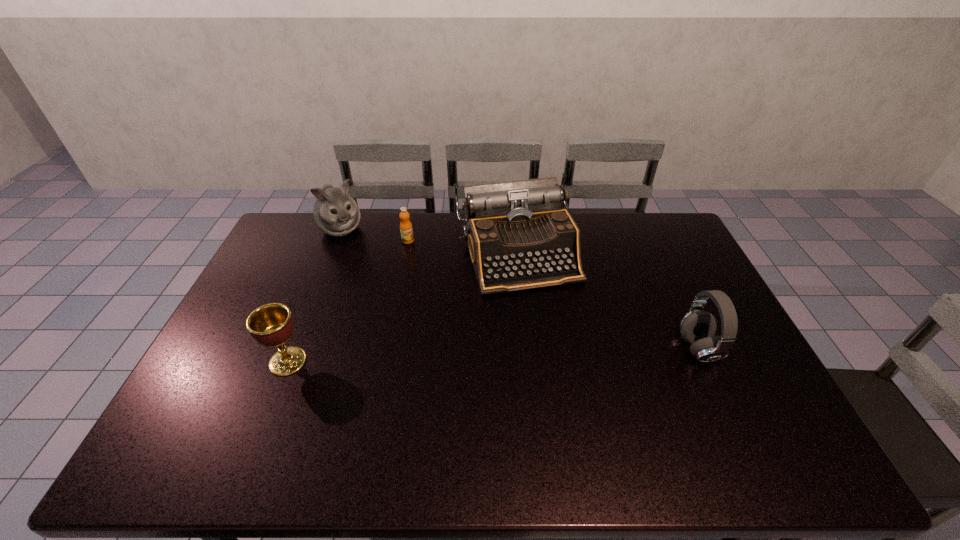
This screenshot has height=540, width=960. Identify the location of free location that satisfies the following two spatial constraints: 1. on the front side of the headset; 2. on the ear cups of the hamster. (293, 349).

You are a GUI agent. You are given a task and a screenshot of the screen. Output one action in this format:
    pyautogui.click(x=<x>, y=<y>)
    Task: Click on the vacant space that satisfies the following two spatial constraints: 1. on the back side of the chalice; 2. on the left side of the typewriter
    
    Given the screenshot: What is the action you would take?
    pyautogui.click(x=330, y=254)

At what (x,y) coordinates should I click in order to perform the action: click on free region that satisfies the following two spatial constraints: 1. on the back side of the chalice; 2. on the left side of the orange juice. Please return your answer as a coordinate pair (x, y). This screenshot has width=960, height=540. Looking at the image, I should click on (336, 241).

What are the coordinates of `free spot that satisfies the following two spatial constraints: 1. on the front side of the hamster; 2. on the right side of the shortest object` in the screenshot? It's located at (336, 241).

Image resolution: width=960 pixels, height=540 pixels. In order to click on free spot that satisfies the following two spatial constraints: 1. on the front side of the third object from right to left; 2. on the right side of the second object from right to left in this screenshot , I will do (x=405, y=254).